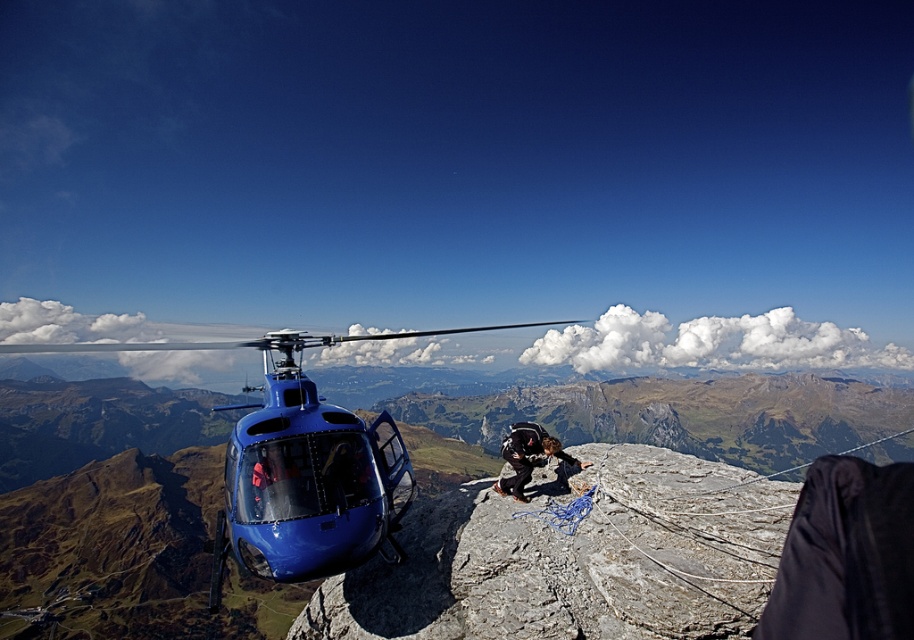
Is rough textured rock at center smaller than blue glossy helicopter at center?

Indeed, rough textured rock at center has a smaller size compared to blue glossy helicopter at center.

Who is shorter, rough textured rock at center or blue glossy helicopter at center?

rough textured rock at center

Is point (497, 515) positioned before point (304, 577)?

No, (497, 515) is further to viewer.

Image resolution: width=914 pixels, height=640 pixels. What are the coordinates of `rough textured rock at center` in the screenshot? It's located at (572, 557).

Can you confirm if rough textured rock at center is positioned above black fabric jacket at center?

Yes, rough textured rock at center is above black fabric jacket at center.

Which is behind, point (635, 611) or point (539, 426)?

The point (539, 426) is behind.

Locate an element on the screen. The width and height of the screenshot is (914, 640). rough textured rock at center is located at coordinates [x=572, y=557].

Is point (198, 342) closer to camera compared to point (509, 480)?

No.

Based on the photo, can you confirm if blue glossy helicopter at center is taller than black fabric jacket at center?

Indeed, blue glossy helicopter at center has a greater height compared to black fabric jacket at center.

Who is more forward, (306, 438) or (509, 461)?

Point (306, 438) is more forward.

Locate an element on the screen. This screenshot has width=914, height=640. blue glossy helicopter at center is located at coordinates (301, 465).